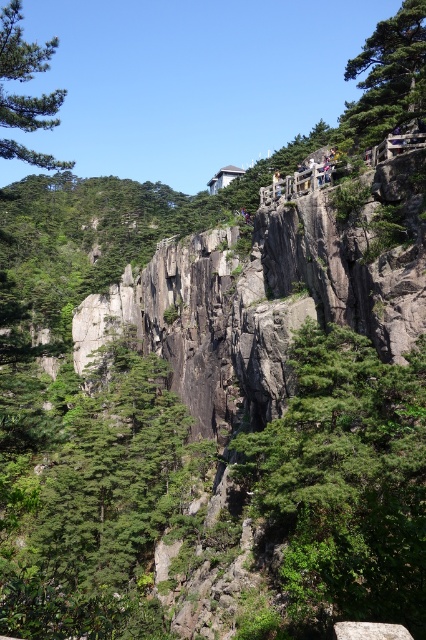
Question: Which object is farther from the camera taking this photo?

Choices:
 (A) green textured rock at center
 (B) green matte tree at center
 (C) green matte tree at upper right

Answer: (C)

Question: Is green textured rock at center closer to the viewer compared to green matte tree at upper right?

Choices:
 (A) yes
 (B) no

Answer: (A)

Question: Is green matte tree at center below green matte tree at upper right?

Choices:
 (A) yes
 (B) no

Answer: (A)

Question: From the image, what is the correct spatial relationship of green textured rock at center in relation to green matte tree at center?

Choices:
 (A) above
 (B) below

Answer: (A)

Question: Among these objects, which one is nearest to the camera?

Choices:
 (A) green textured rock at center
 (B) green matte tree at upper right
 (C) green matte tree at upper left
 (D) green matte tree at center

Answer: (A)

Question: Estimate the real-world distances between objects in this image. Which object is closer to the green matte tree at upper right?

Choices:
 (A) green matte tree at upper left
 (B) green textured rock at center
 (C) green matte tree at center

Answer: (B)